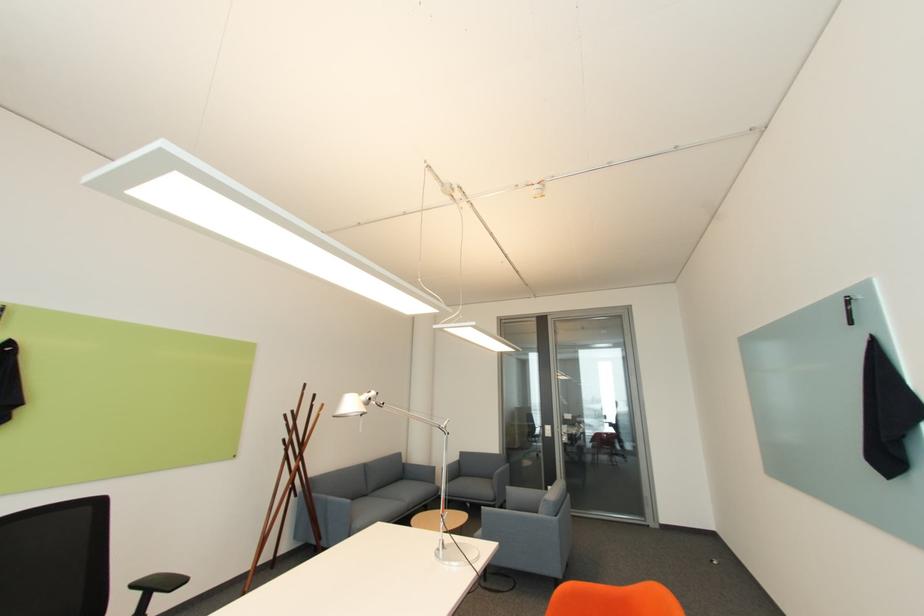
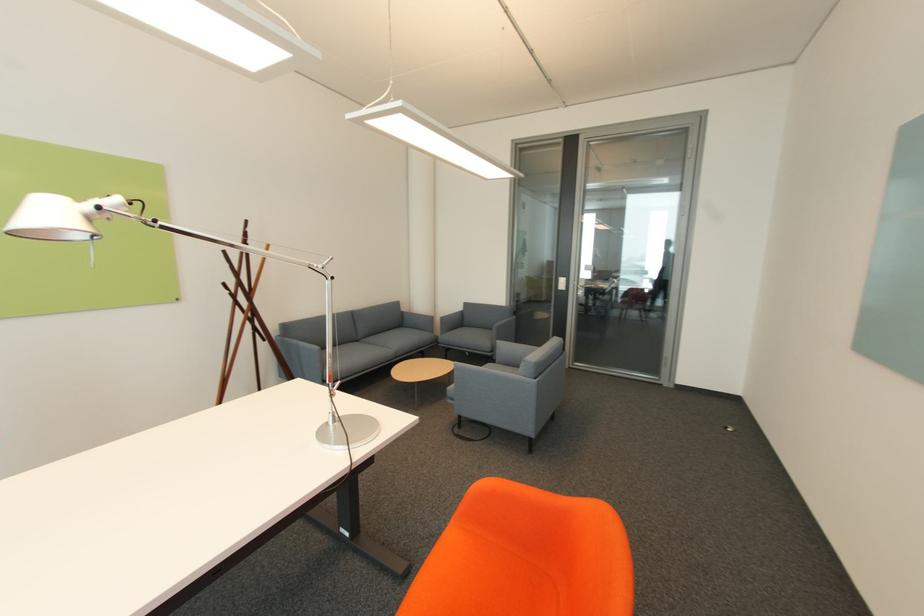
The images are taken continuously from a first-person perspective. In which direction are you moving?

The cameraman walked toward right, forward.